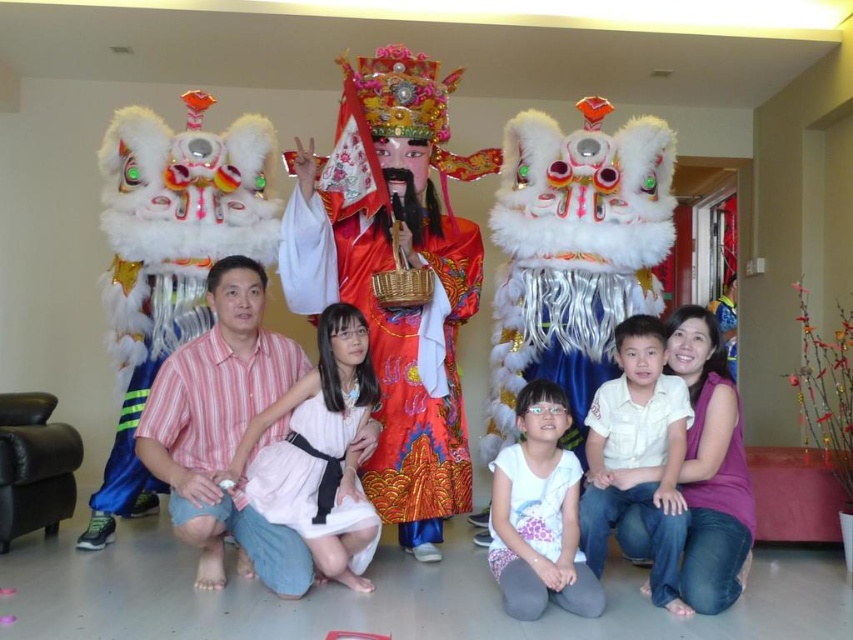
Question: Does matte white dress at center have a lesser width compared to white matte dress at center?

Choices:
 (A) no
 (B) yes

Answer: (A)

Question: Which point appears closest to the camera in this image?

Choices:
 (A) (660, 497)
 (B) (134, 512)

Answer: (A)

Question: Is silky red costume at center positioned before pink striped shirt at center?

Choices:
 (A) no
 (B) yes

Answer: (A)

Question: Which object appears farthest from the camera in this image?

Choices:
 (A) shiny red fabric costume at center
 (B) white fluffy lion at left
 (C) white matte dress at center

Answer: (B)

Question: Which point appears closest to the camera in this image?

Choices:
 (A) (473, 260)
 (B) (653, 580)
 (C) (109, 508)
 (D) (148, 461)

Answer: (B)

Question: Can you confirm if pink striped shirt at center is wider than white cotton shirt at lower right?

Choices:
 (A) yes
 (B) no

Answer: (A)